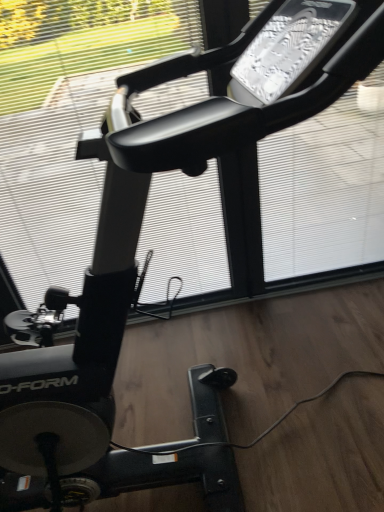
Question: Should I look upward or downward to see transparent plastic window screen at upper center, which is the second window screen in left-to-right order?

Choices:
 (A) down
 (B) up

Answer: (B)

Question: Does transparent plastic window screen at upper center, which is the second window screen in left-to-right order, have a lesser width compared to white matte window screen at center, which ranks as the first window screen in left-to-right order?

Choices:
 (A) no
 (B) yes

Answer: (A)

Question: Are transparent plastic window screen at upper center, which is the second window screen in left-to-right order, and white matte window screen at center, acting as the second window screen starting from the right, beside each other?

Choices:
 (A) yes
 (B) no

Answer: (B)

Question: Is transparent plastic window screen at upper center, which is the second window screen in left-to-right order, taller than white matte window screen at center, which ranks as the first window screen in left-to-right order?

Choices:
 (A) no
 (B) yes

Answer: (A)

Question: Can you confirm if transparent plastic window screen at upper center, which is the second window screen in left-to-right order, is shorter than white matte window screen at center, acting as the second window screen starting from the right?

Choices:
 (A) no
 (B) yes

Answer: (B)

Question: Is transparent plastic window screen at upper center, which is the second window screen in left-to-right order, looking in the opposite direction of white matte window screen at center, which ranks as the first window screen in left-to-right order?

Choices:
 (A) yes
 (B) no

Answer: (B)

Question: Does transparent plastic window screen at upper center, which is the second window screen in left-to-right order, have a greater width compared to white matte window screen at center, which ranks as the first window screen in left-to-right order?

Choices:
 (A) yes
 (B) no

Answer: (A)

Question: Could you tell me if white matte window screen at center, which ranks as the first window screen in left-to-right order, is facing transparent plastic window screen at upper center, which is the second window screen in left-to-right order?

Choices:
 (A) yes
 (B) no

Answer: (B)

Question: From the image's perspective, is white matte window screen at center, which ranks as the first window screen in left-to-right order, located above transparent plastic window screen at upper center, which is the second window screen in left-to-right order?

Choices:
 (A) no
 (B) yes

Answer: (A)

Question: Considering the relative sizes of white matte window screen at center, acting as the second window screen starting from the right, and transparent plastic window screen at upper center, placed as the 1th window screen when sorted from right to left, in the image provided, is white matte window screen at center, acting as the second window screen starting from the right, shorter than transparent plastic window screen at upper center, placed as the 1th window screen when sorted from right to left,?

Choices:
 (A) no
 (B) yes

Answer: (A)

Question: Considering the relative positions of white matte window screen at center, acting as the second window screen starting from the right, and transparent plastic window screen at upper center, which is the second window screen in left-to-right order, in the image provided, is white matte window screen at center, acting as the second window screen starting from the right, to the left of transparent plastic window screen at upper center, which is the second window screen in left-to-right order, from the viewer's perspective?

Choices:
 (A) yes
 (B) no

Answer: (A)

Question: Considering the relative sizes of white matte window screen at center, acting as the second window screen starting from the right, and transparent plastic window screen at upper center, which is the second window screen in left-to-right order, in the image provided, is white matte window screen at center, acting as the second window screen starting from the right, taller than transparent plastic window screen at upper center, which is the second window screen in left-to-right order,?

Choices:
 (A) yes
 (B) no

Answer: (A)

Question: Is white matte window screen at center, which ranks as the first window screen in left-to-right order, surrounding transparent plastic window screen at upper center, placed as the 1th window screen when sorted from right to left?

Choices:
 (A) yes
 (B) no

Answer: (B)

Question: Is transparent plastic window screen at upper center, placed as the 1th window screen when sorted from right to left, bigger or smaller than white matte window screen at center, acting as the second window screen starting from the right?

Choices:
 (A) small
 (B) big

Answer: (A)